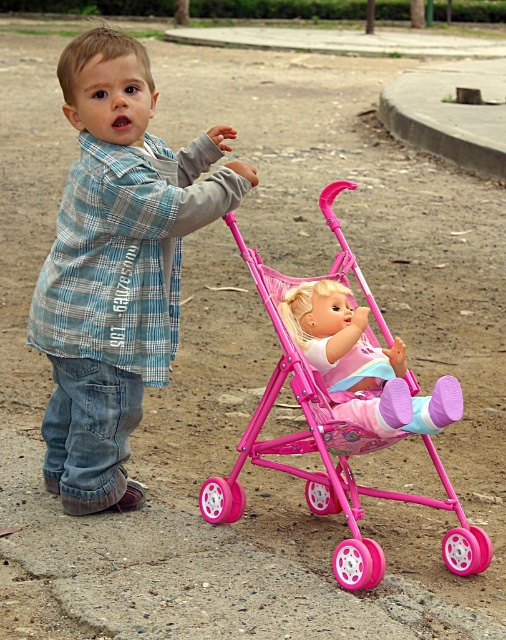
A child is holding a blue plaid shirt at center and a pink plastic baby carriage at center. The child wants to know if they can hold both items at the same time without them touching. Can they? Please explain based on the distance between them.

The distance between the blue plaid shirt at center and the pink plastic baby carriage at center is 21.59 inches. Since the child can hold both items apart by this distance, they can hold them simultaneously without them touching.